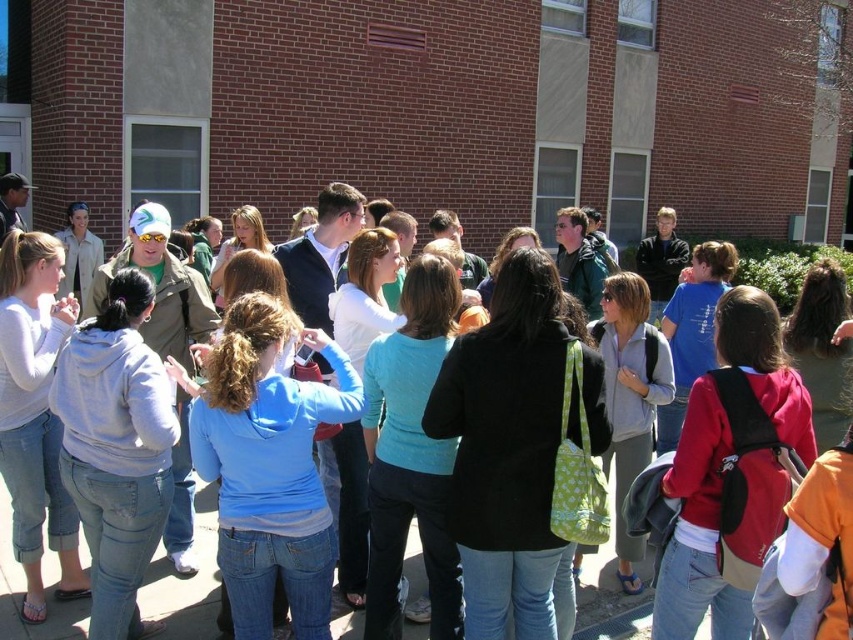
In the scene shown: Is blue fleece jacket at center smaller than matte blue hoodie at center?

Actually, blue fleece jacket at center might be larger than matte blue hoodie at center.

Looking at this image, does blue fleece jacket at center have a larger size compared to matte blue hoodie at center?

Correct, blue fleece jacket at center is larger in size than matte blue hoodie at center.

Image resolution: width=853 pixels, height=640 pixels. Describe the element at coordinates (270, 467) in the screenshot. I see `blue fleece jacket at center` at that location.

The height and width of the screenshot is (640, 853). I want to click on blue fleece jacket at center, so click(x=270, y=467).